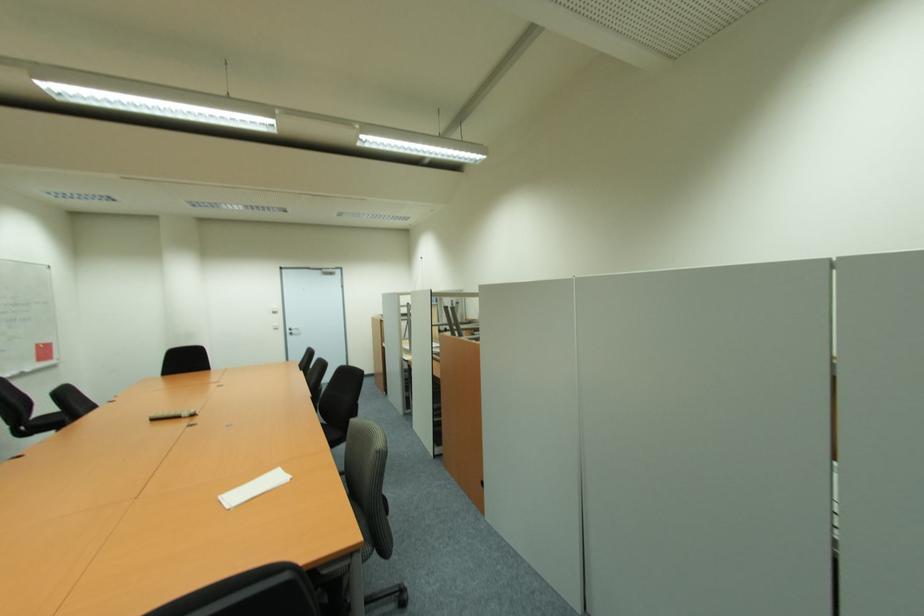
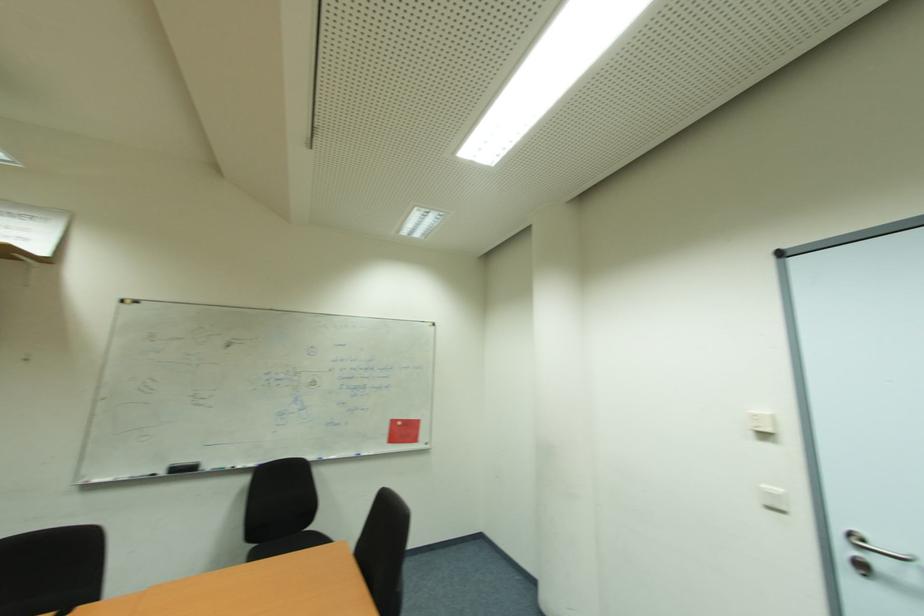
In the second image, find the point that corresponds to pixel 295 334 in the first image.

(869, 570)